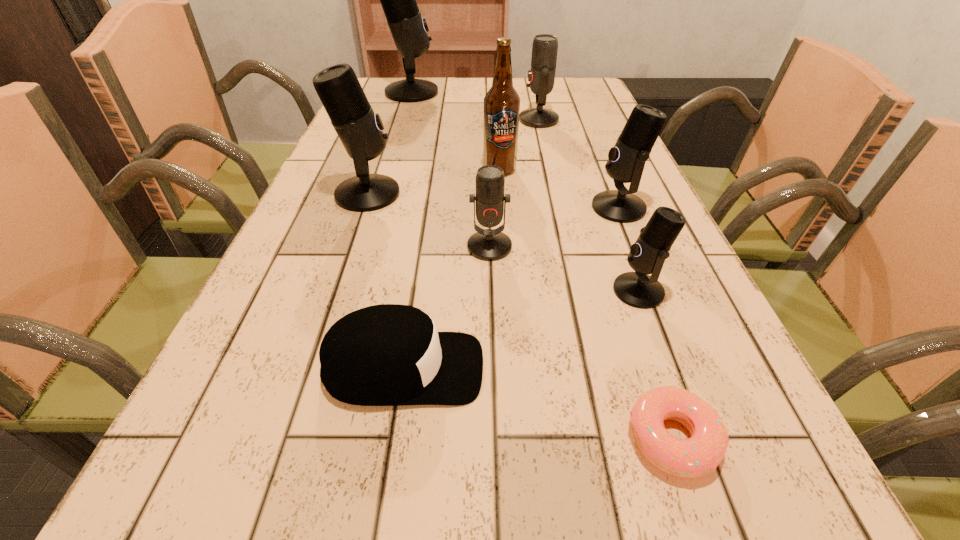
Image resolution: width=960 pixels, height=540 pixels. Find the location of `free area in between the eighth nearest object and the doughnut`. free area in between the eighth nearest object and the doughnut is located at coordinates (605, 279).

The image size is (960, 540). I want to click on free space that is in between the third smallest black microphone and the second farthest microphone, so click(x=453, y=157).

At what (x,y) coordinates should I click in order to perform the action: click on free point between the tallest microphone and the third microphone from right to left. Please return your answer as a coordinate pair (x, y). Image resolution: width=960 pixels, height=540 pixels. Looking at the image, I should click on (475, 106).

Image resolution: width=960 pixels, height=540 pixels. I want to click on free point between the third biggest black microphone and the beer bottle, so coord(559,188).

Where is `vacant region between the pink doughnut and the fourth nearest object`? vacant region between the pink doughnut and the fourth nearest object is located at coordinates (581, 342).

Locate an element on the screen. This screenshot has width=960, height=540. vacant space that is in between the doughnut and the beer bottle is located at coordinates (586, 304).

At what (x,y) coordinates should I click in order to perform the action: click on object that is the eighth closest to the cap. Please return your answer as a coordinate pair (x, y). The height and width of the screenshot is (540, 960). Looking at the image, I should click on point(409,29).

Identify which object is located as the nearest to the second biggest black microphone. Please provide its 2D coordinates. Your answer should be formatted as a tuple, i.e. [(x, y)], where the tuple contains the x and y coordinates of a point satisfying the conditions above.

[(486, 244)]

This screenshot has height=540, width=960. What are the coordinates of `the fifth closest microphone to the farthest object` in the screenshot? It's located at (647, 255).

Identify which microphone is located as the fourth nearest to the black cap. Please provide its 2D coordinates. Your answer should be formatted as a tuple, i.e. [(x, y)], where the tuple contains the x and y coordinates of a point satisfying the conditions above.

[(626, 160)]